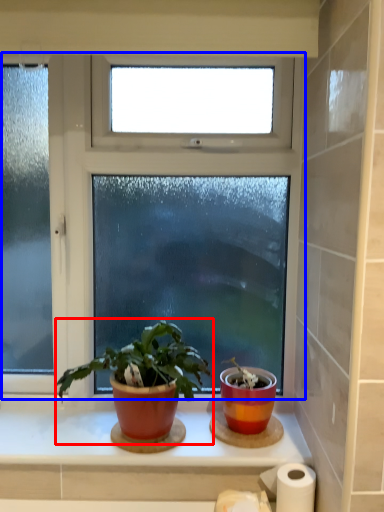
Question: Which object is further to the camera taking this photo, houseplant (highlighted by a red box) or window (highlighted by a blue box)?

Choices:
 (A) houseplant
 (B) window

Answer: (B)